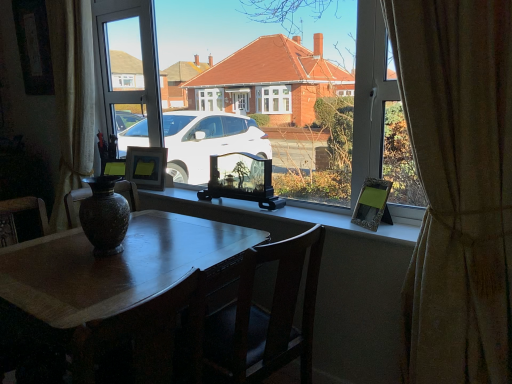
Find the location of `vacant area located to the right-hand side of marbled stone vase at center`. vacant area located to the right-hand side of marbled stone vase at center is located at coordinates (151, 246).